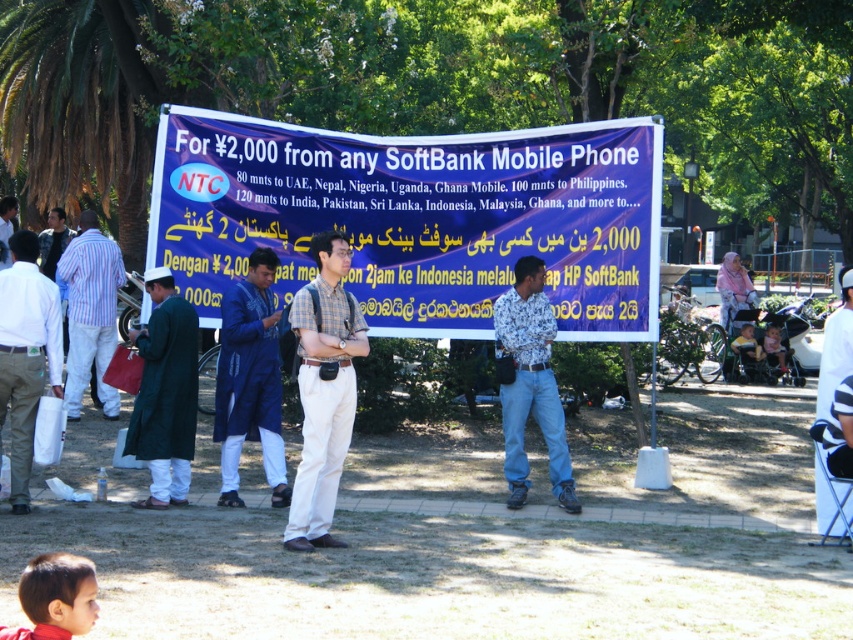
Question: Which point appears farthest from the camera in this image?

Choices:
 (A) (775, 332)
 (B) (108, 310)
 (C) (251, 128)
 (D) (515, 493)

Answer: (A)

Question: Which point is closer to the camera taking this photo?

Choices:
 (A) (305, 355)
 (B) (283, 477)
 (C) (630, 122)
 (D) (57, 317)

Answer: (A)

Question: Which is nearer to the white fabric chair at center?

Choices:
 (A) plaid fabric shirt at center
 (B) blue cotton kurta at center
 (C) floral shirt at center
 (D) striped cotton shirt at left

Answer: (C)

Question: Is smooth brown hair at lower left wider than dark green coat at left?

Choices:
 (A) yes
 (B) no

Answer: (B)

Question: Is floral shirt at center below dark green coat at left?

Choices:
 (A) no
 (B) yes

Answer: (B)

Question: Can you confirm if blue cotton kurta at center is bigger than smooth brown hair at lower left?

Choices:
 (A) yes
 (B) no

Answer: (A)